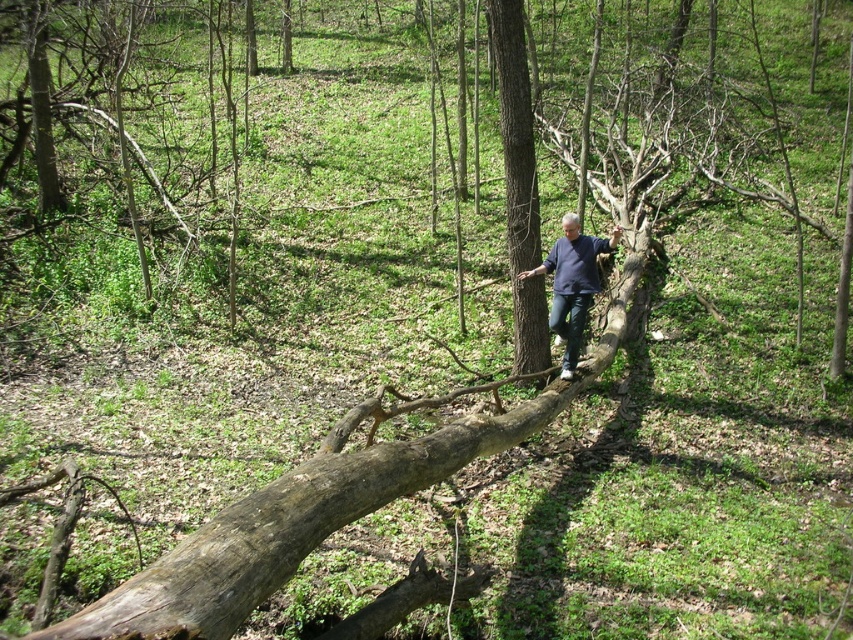
You are a hiker trying to cross the brown rough tree trunk at center. Your backpack has a dark blue shirt at center. Can you safely place your backpack on the tree trunk without it falling off?

The brown rough tree trunk at center is taller than the dark blue shirt at center, so placing the backpack on it would be stable as the trunk provides a higher surface. However, the dark blue shirt at center might not offer enough support if placed separately. Ensure the backpack is secured on the tree trunk itself.

You are a hiker trying to cross the brown rough tree trunk at center. You notice the dark blue shirt at center of the person walking ahead. Which object is narrower in this scene?

The brown rough tree trunk at center is thinner than the dark blue shirt at center, so the tree trunk is narrower.